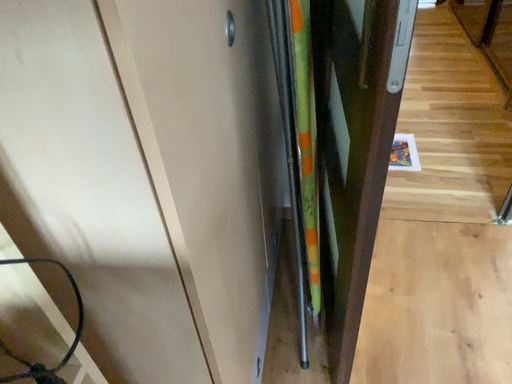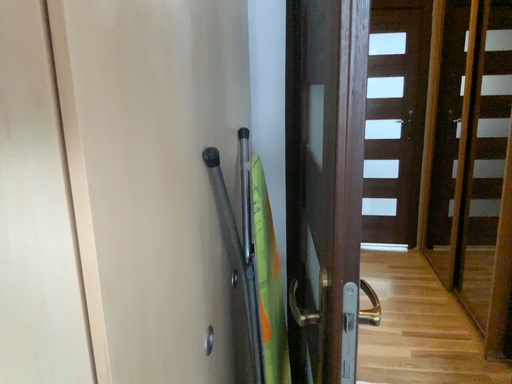
Question: How did the camera likely rotate when shooting the video?

Choices:
 (A) rotated downward
 (B) rotated upward

Answer: (B)